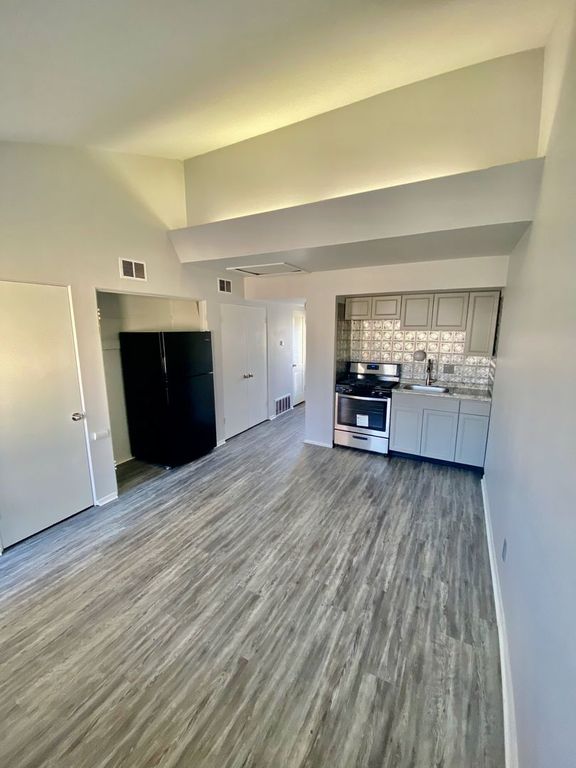
Locate an element on the screen. This screenshot has height=768, width=576. ceiling is located at coordinates (147, 114).